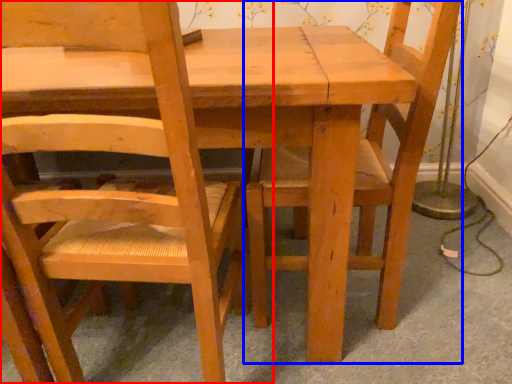
Question: Which object appears farthest to the camera in this image, chair (highlighted by a red box) or chair (highlighted by a blue box)?

Choices:
 (A) chair
 (B) chair

Answer: (B)